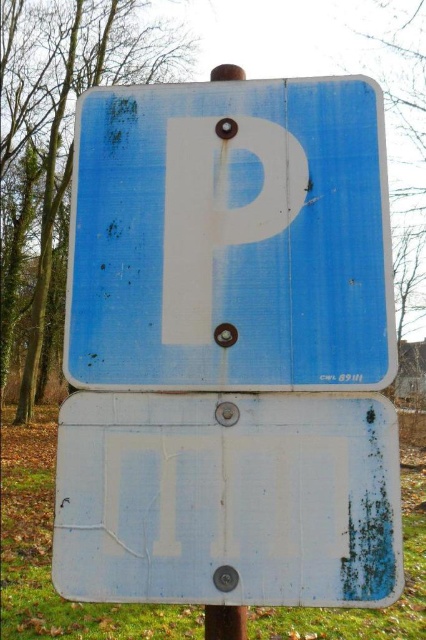
Between matte blue parking sign at center and white matte sign at center, which one is positioned lower?

white matte sign at center is below.

Who is higher up, matte blue parking sign at center or white matte sign at center?

matte blue parking sign at center is higher up.

Locate an element on the screen. matte blue parking sign at center is located at coordinates (230, 237).